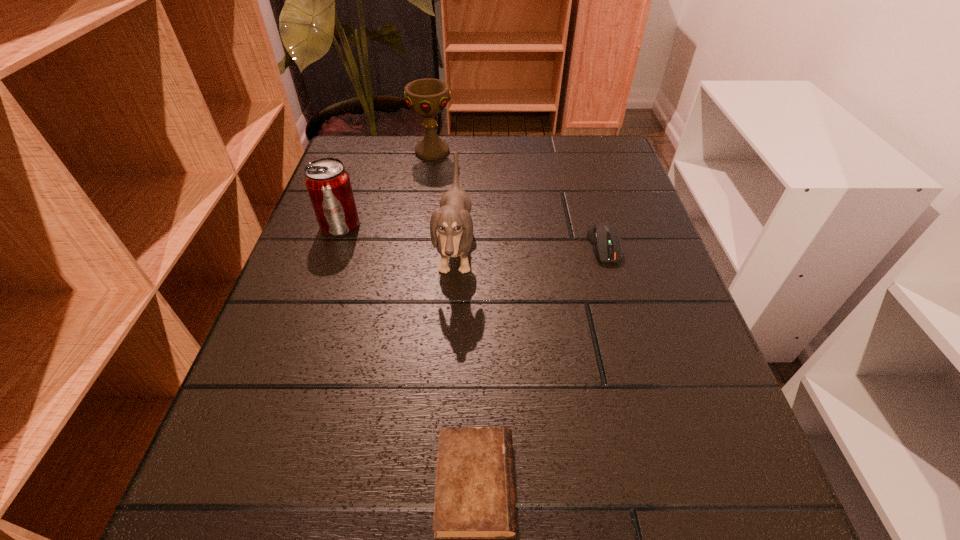
The image size is (960, 540). Identify the location of the fourth closest object to the nearest object. (427, 97).

Locate an element on the screen. The height and width of the screenshot is (540, 960). the closest object to the diary is located at coordinates (453, 221).

You are a GUI agent. You are given a task and a screenshot of the screen. Output one action in this format:
    pyautogui.click(x=<x>, y=<y>)
    Task: Click on the free location that satisfies the following two spatial constraints: 1. on the button of the computer equipment; 2. on the spine side of the nearest object
    
    Given the screenshot: What is the action you would take?
    pyautogui.click(x=674, y=485)